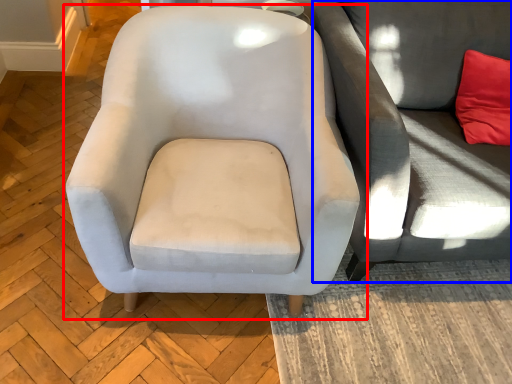
Question: Which object appears closest to the camera in this image, chair (highlighted by a red box) or studio couch (highlighted by a blue box)?

Choices:
 (A) chair
 (B) studio couch

Answer: (A)